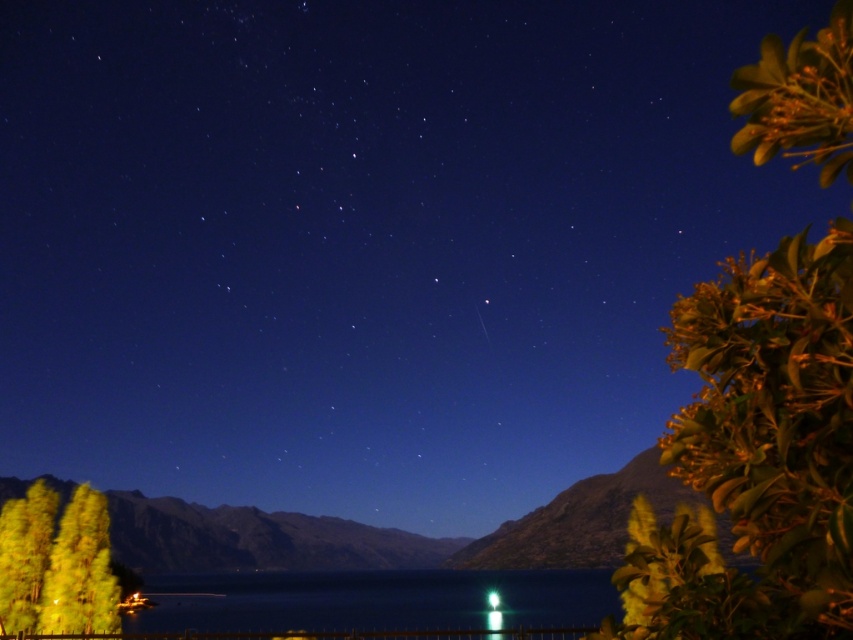
Between green glossy leaves at upper right and shiny blue water at center, which one appears on the left side from the viewer's perspective?

shiny blue water at center

Does green glossy leaves at upper right appear on the left side of shiny blue water at center?

Incorrect, green glossy leaves at upper right is not on the left side of shiny blue water at center.

Is point (714, 316) positioned after point (465, 596)?

No, (714, 316) is closer to viewer.

This screenshot has height=640, width=853. I want to click on green glossy leaves at upper right, so click(x=755, y=456).

Where is `shiny blue water at center`? shiny blue water at center is located at coordinates (373, 600).

Is shiny blue water at center bigger than shiny yellow leaves at lower left?

Correct, shiny blue water at center is larger in size than shiny yellow leaves at lower left.

The width and height of the screenshot is (853, 640). I want to click on shiny blue water at center, so click(x=373, y=600).

Is shiny yellow leaves at lower left taller than green translucent light at lower center?

Yes.

Who is positioned more to the left, shiny yellow leaves at lower left or green translucent light at lower center?

From the viewer's perspective, shiny yellow leaves at lower left appears more on the left side.

Which is behind, point (47, 604) or point (495, 600)?

Positioned behind is point (495, 600).

The height and width of the screenshot is (640, 853). What are the coordinates of `shiny yellow leaves at lower left` in the screenshot? It's located at (56, 564).